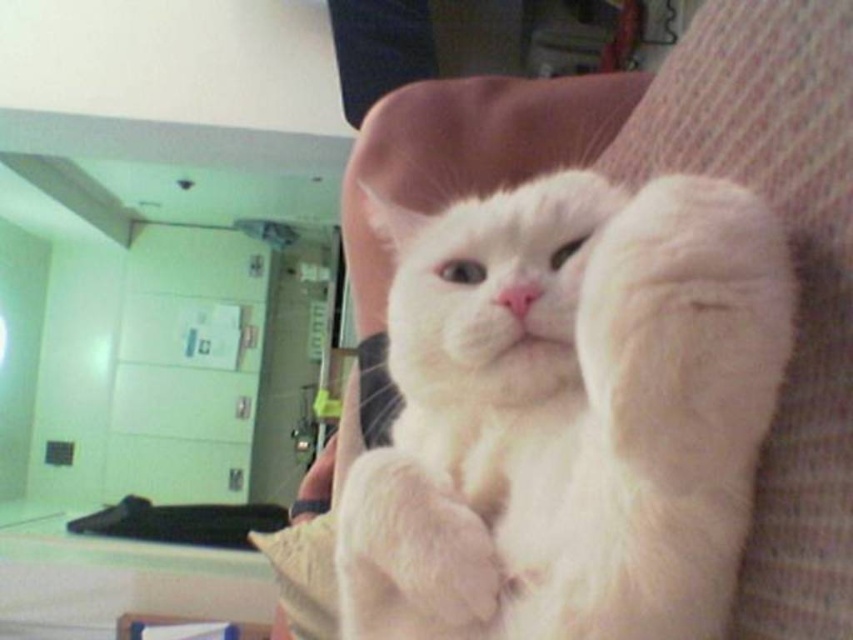
Is point (728, 369) behind point (438, 627)?

No.

Does white fluffy cat at center appear over white fluffy paw at center?

Correct, white fluffy cat at center is located above white fluffy paw at center.

Between point (383, 208) and point (352, 625), which one is positioned in front?

Point (352, 625) is more forward.

Locate an element on the screen. white fluffy cat at center is located at coordinates (569, 413).